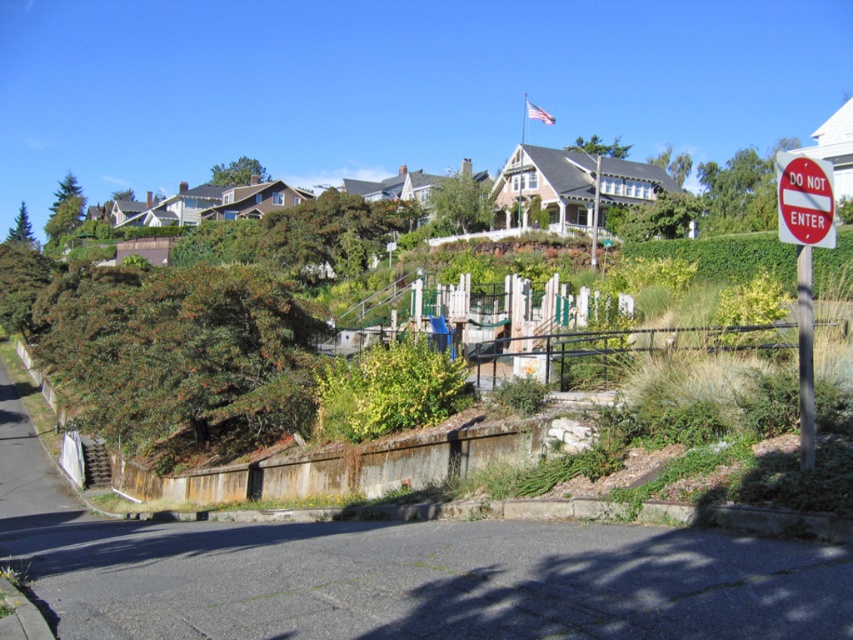
Is red plastic sign at right wider than white plastic signpost at right?

Yes, red plastic sign at right is wider than white plastic signpost at right.

Which is behind, point (799, 180) or point (799, 436)?

The point (799, 436) is behind.

Locate an element on the screen. Image resolution: width=853 pixels, height=640 pixels. red plastic sign at right is located at coordinates (804, 200).